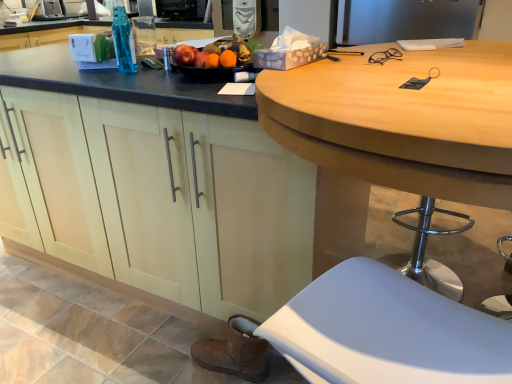
This screenshot has width=512, height=384. What are the coordinates of `vacant space to the left of clear plastic glasses at upper right` in the screenshot? It's located at (333, 66).